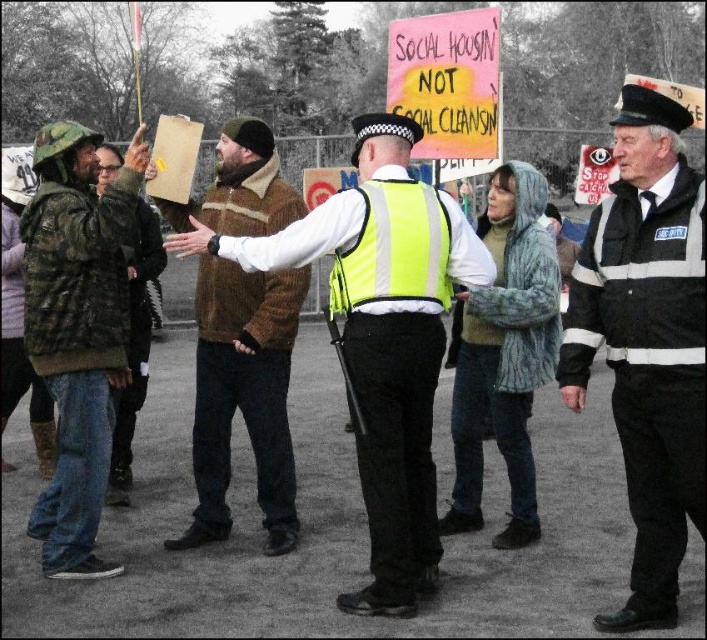
Question: Is black uniform at center above camouflage jacket at left?

Choices:
 (A) yes
 (B) no

Answer: (A)

Question: Does brown fuzzy jacket at center have a larger size compared to camouflage jacket at left?

Choices:
 (A) no
 (B) yes

Answer: (B)

Question: Which object appears farthest from the camera in this image?

Choices:
 (A) brown fuzzy jacket at center
 (B) black uniform at center
 (C) camouflage fabric jacket at left

Answer: (A)

Question: Considering the real-world distances, which object is farthest from the black uniform at center?

Choices:
 (A) camouflage jacket at left
 (B) brown fuzzy jacket at center

Answer: (A)

Question: Which object is positioned farthest from the brown woolen jacket at center?

Choices:
 (A) camouflage jacket at left
 (B) brown fuzzy jacket at center

Answer: (A)

Question: Can you confirm if black uniform at center is positioned below camouflage fabric jacket at left?

Choices:
 (A) yes
 (B) no

Answer: (A)